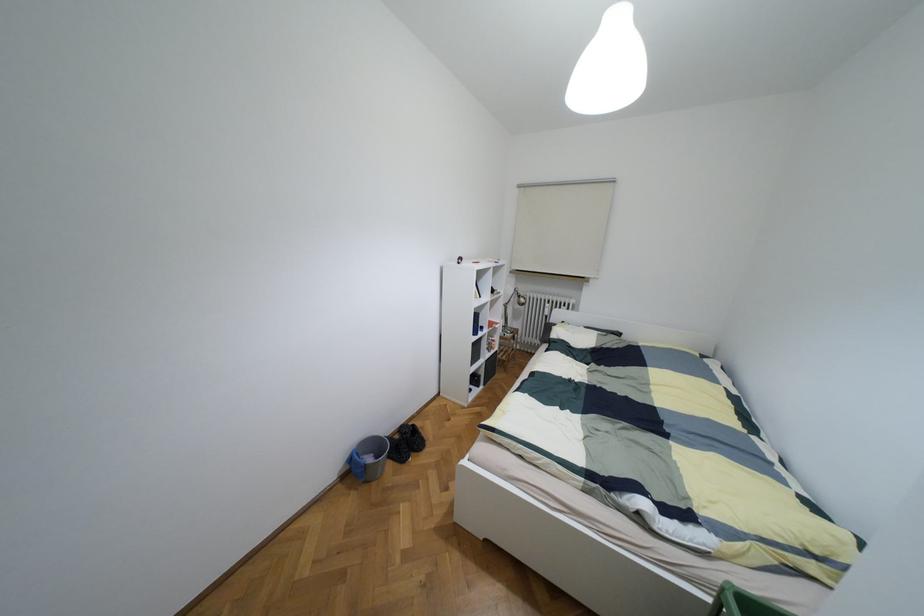
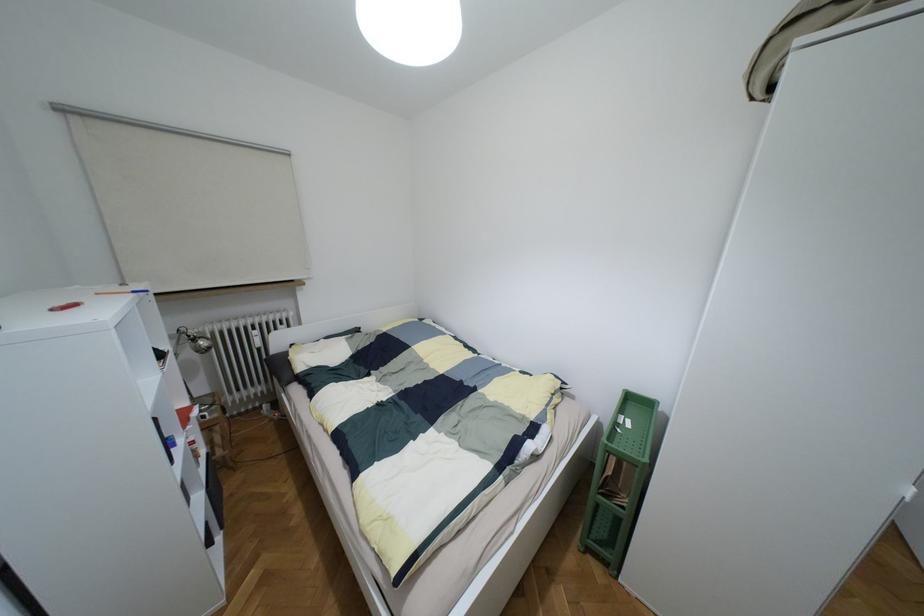
Question: The camera is either moving clockwise (left) or counter-clockwise (right) around the object. The first image is from the beginning of the video and the second image is from the end. Is the camera moving left or right when shooting the video?

Choices:
 (A) Left
 (B) Right

Answer: (A)